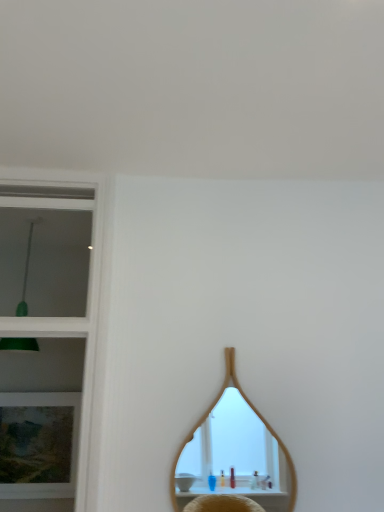
Question: Is wooden mirror at center further to camera compared to matte wooden picture frame at left?

Choices:
 (A) yes
 (B) no

Answer: (B)

Question: Is wooden mirror at center outside matte wooden picture frame at left?

Choices:
 (A) yes
 (B) no

Answer: (A)

Question: Is wooden mirror at center shorter than matte wooden picture frame at left?

Choices:
 (A) no
 (B) yes

Answer: (A)

Question: Is wooden mirror at center smaller than matte wooden picture frame at left?

Choices:
 (A) yes
 (B) no

Answer: (A)

Question: Is wooden mirror at center next to matte wooden picture frame at left?

Choices:
 (A) no
 (B) yes

Answer: (A)

Question: Can you confirm if wooden mirror at center is taller than matte wooden picture frame at left?

Choices:
 (A) yes
 (B) no

Answer: (A)

Question: Is wooden mirror at center inside matte wooden picture frame at left?

Choices:
 (A) yes
 (B) no

Answer: (B)

Question: Is matte wooden picture frame at left not inside wooden mirror at center?

Choices:
 (A) no
 (B) yes

Answer: (B)

Question: Is matte wooden picture frame at left aimed at wooden mirror at center?

Choices:
 (A) no
 (B) yes

Answer: (A)

Question: Can you confirm if matte wooden picture frame at left is taller than wooden mirror at center?

Choices:
 (A) yes
 (B) no

Answer: (B)

Question: Does matte wooden picture frame at left come in front of wooden mirror at center?

Choices:
 (A) no
 (B) yes

Answer: (A)

Question: Does matte wooden picture frame at left have a smaller size compared to wooden mirror at center?

Choices:
 (A) no
 (B) yes

Answer: (A)

Question: In terms of height, does matte wooden picture frame at left look taller or shorter compared to wooden mirror at center?

Choices:
 (A) short
 (B) tall

Answer: (A)